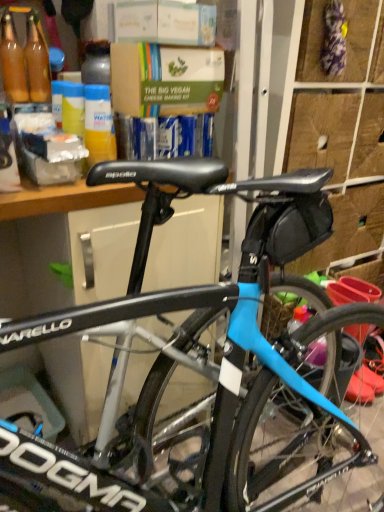
Identify the location of black matte bicycle seat at center. The height and width of the screenshot is (512, 384). (206, 370).

This screenshot has height=512, width=384. What do you see at coordinates (206, 370) in the screenshot? I see `black matte bicycle seat at center` at bounding box center [206, 370].

The width and height of the screenshot is (384, 512). In order to click on black matte bicycle seat at center in this screenshot , I will do `click(206, 370)`.